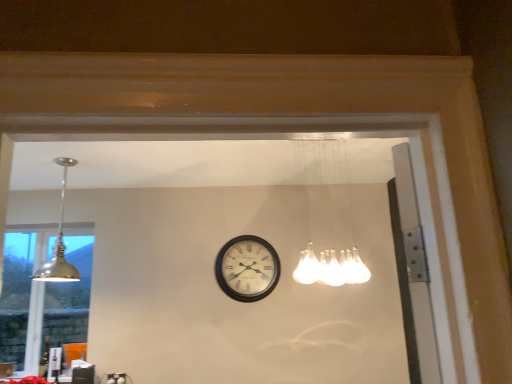
Question: Is matte silver lampshade at left outside matte silver pendant light at upper left, placed as the second lamp when sorted from right to left?

Choices:
 (A) yes
 (B) no

Answer: (A)

Question: Is matte silver lampshade at left bigger than matte silver pendant light at upper left, the 1th lamp viewed from the left?

Choices:
 (A) yes
 (B) no

Answer: (B)

Question: Considering the relative positions of matte silver lampshade at left and matte silver pendant light at upper left, the 1th lamp viewed from the left, in the image provided, is matte silver lampshade at left in front of matte silver pendant light at upper left, the 1th lamp viewed from the left,?

Choices:
 (A) yes
 (B) no

Answer: (B)

Question: Does matte silver lampshade at left have a greater width compared to matte silver pendant light at upper left, the 1th lamp viewed from the left?

Choices:
 (A) no
 (B) yes

Answer: (A)

Question: Is matte silver lampshade at left turned away from matte silver pendant light at upper left, placed as the second lamp when sorted from right to left?

Choices:
 (A) no
 (B) yes

Answer: (A)

Question: Based on their positions, is black wooden clock at center located to the left or right of matte silver pendant light at upper left, placed as the second lamp when sorted from right to left?

Choices:
 (A) right
 (B) left

Answer: (A)

Question: Is point tap(260, 259) closer or farther from the camera than point tap(56, 269)?

Choices:
 (A) closer
 (B) farther

Answer: (B)

Question: From a real-world perspective, is black wooden clock at center physically located above or below matte silver pendant light at upper left, placed as the second lamp when sorted from right to left?

Choices:
 (A) below
 (B) above

Answer: (A)

Question: From the image's perspective, is black wooden clock at center above or below matte silver pendant light at upper left, placed as the second lamp when sorted from right to left?

Choices:
 (A) below
 (B) above

Answer: (A)

Question: In the image, is matte silver pendant light at upper left, the 1th lamp viewed from the left, on the left side or the right side of white frosted glass light fixture at upper center, arranged as the 1th lamp when viewed from the right?

Choices:
 (A) right
 (B) left

Answer: (B)

Question: Does point (45, 269) appear closer or farther from the camera than point (343, 213)?

Choices:
 (A) farther
 (B) closer

Answer: (B)

Question: Is matte silver pendant light at upper left, the 1th lamp viewed from the left, bigger or smaller than white frosted glass light fixture at upper center, which appears as the 2th lamp when viewed from the left?

Choices:
 (A) big
 (B) small

Answer: (B)

Question: From a real-world perspective, is matte silver pendant light at upper left, placed as the second lamp when sorted from right to left, above or below white frosted glass light fixture at upper center, which appears as the 2th lamp when viewed from the left?

Choices:
 (A) below
 (B) above

Answer: (B)

Question: From the image's perspective, is white frosted glass light fixture at upper center, which appears as the 2th lamp when viewed from the left, positioned above or below matte silver pendant light at upper left, the 1th lamp viewed from the left?

Choices:
 (A) below
 (B) above

Answer: (B)

Question: Considering the positions of white frosted glass light fixture at upper center, which appears as the 2th lamp when viewed from the left, and matte silver pendant light at upper left, the 1th lamp viewed from the left, in the image, is white frosted glass light fixture at upper center, which appears as the 2th lamp when viewed from the left, taller or shorter than matte silver pendant light at upper left, the 1th lamp viewed from the left,?

Choices:
 (A) tall
 (B) short

Answer: (A)